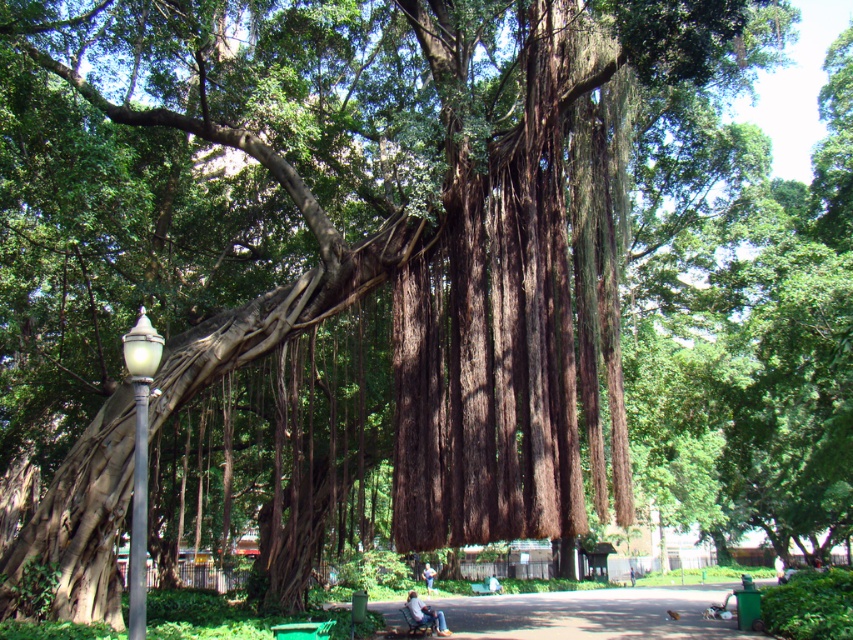
Is smooth concrete path at lower center below light blue denim jeans at lower center?

Incorrect, smooth concrete path at lower center is not positioned below light blue denim jeans at lower center.

Is smooth concrete path at lower center smaller than light blue denim jeans at lower center?

No.

Is point (392, 621) positioned behind point (432, 582)?

No, (392, 621) is in front of (432, 582).

This screenshot has width=853, height=640. In order to click on smooth concrete path at lower center in this screenshot , I will do `click(593, 612)`.

Does matte black lamp post at left have a lesser width compared to light blue denim jeans at lower center?

In fact, matte black lamp post at left might be wider than light blue denim jeans at lower center.

Measure the distance between point (134, 481) and camera.

The distance of point (134, 481) from camera is 6.99 meters.

At what (x,y) coordinates should I click in order to perform the action: click on matte black lamp post at left. Please return your answer as a coordinate pair (x, y). The width and height of the screenshot is (853, 640). Looking at the image, I should click on (138, 460).

What do you see at coordinates (138, 460) in the screenshot? I see `matte black lamp post at left` at bounding box center [138, 460].

Is matte black lamp post at left closer to camera compared to denim jeans at lower center?

Yes, it is.

Between point (144, 321) and point (445, 632), which one is positioned behind?

The point (445, 632) is behind.

The image size is (853, 640). Find the location of `matte black lamp post at left`. matte black lamp post at left is located at coordinates (138, 460).